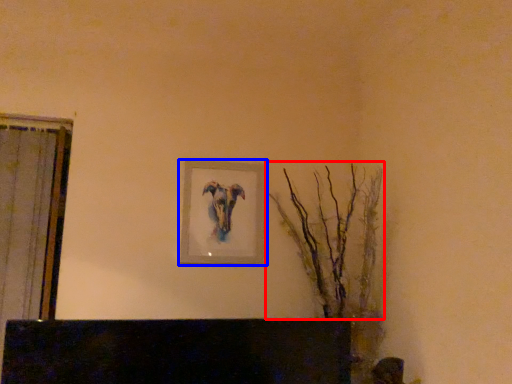
Question: Which point is further to the camera, tree (highlighted by a red box) or picture frame (highlighted by a blue box)?

Choices:
 (A) tree
 (B) picture frame

Answer: (B)